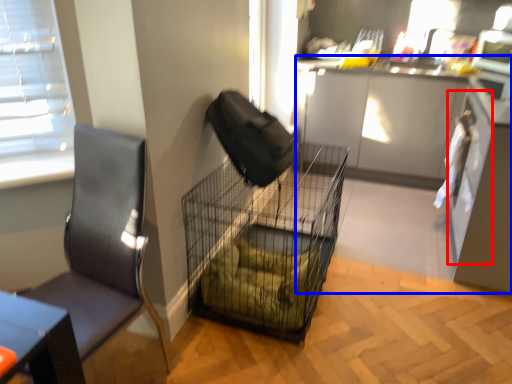
Question: Which object is further to the camera taking this photo, screen door (highlighted by a red box) or cabinetry (highlighted by a blue box)?

Choices:
 (A) screen door
 (B) cabinetry

Answer: (A)